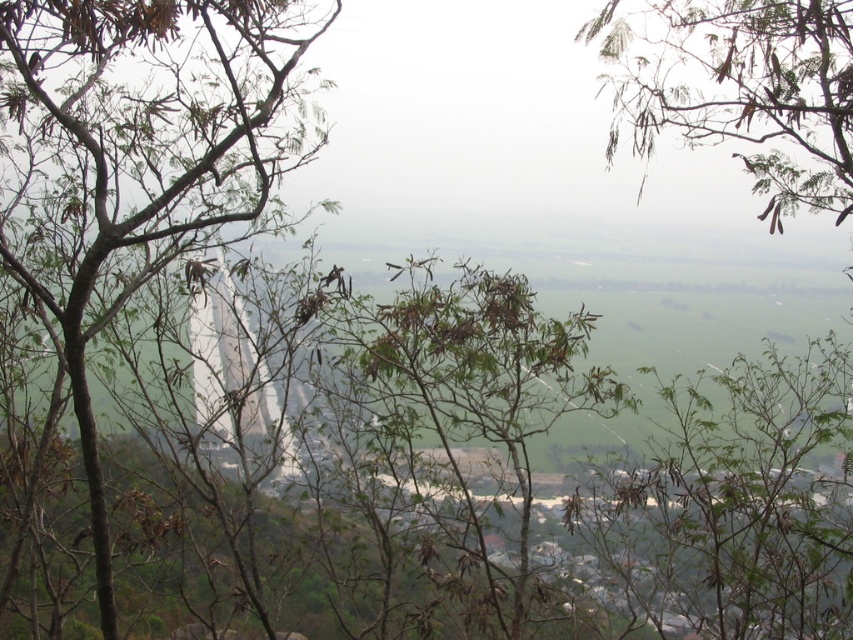
Question: Does brown leafy tree at center lie in front of brown textured tree at center?

Choices:
 (A) no
 (B) yes

Answer: (B)

Question: Which point appears farthest from the camera in this image?

Choices:
 (A) (746, 29)
 (B) (189, 74)

Answer: (B)

Question: Can you confirm if brown leafy tree at center is positioned above green leafy branches at upper center?

Choices:
 (A) yes
 (B) no

Answer: (B)

Question: Which point appears closest to the camera in this image?

Choices:
 (A) (187, 208)
 (B) (494, 416)
 (C) (775, 170)

Answer: (C)

Question: Is brown leafy tree at center positioned at the back of green leafy branches at upper center?

Choices:
 (A) yes
 (B) no

Answer: (B)

Question: Which point is closer to the camera?

Choices:
 (A) (722, 113)
 (B) (403, 304)

Answer: (A)